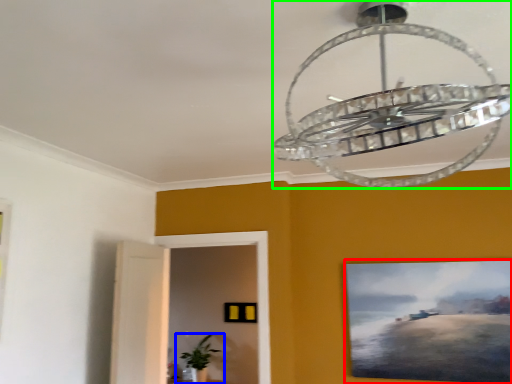
Question: Estimate the real-world distances between objects in this image. Which object is closer to picture frame (highlighted by a red box), houseplant (highlighted by a blue box) or lamp (highlighted by a green box)?

Choices:
 (A) houseplant
 (B) lamp

Answer: (B)